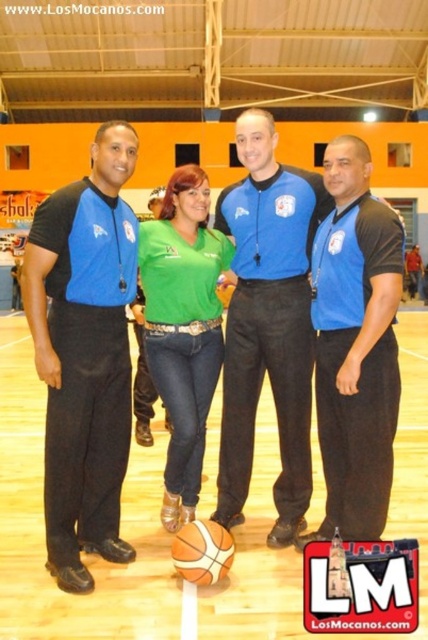
You are a photographer standing at the edge of the basketball court. You want to take a photo that includes both the blue fabric shirt at center and the orange textured basketball at center. What is the minimum distance you need to move backward to ensure both objects are in frame?

The blue fabric shirt at center and orange textured basketball at center are 36.32 inches apart from each other. To capture both in the frame, you need to move back until your camera can encompass a distance of at least 36.32 inches between them. The exact distance depends on your camera lens and sensor size, but ensuring the frame width accommodates this separation is essential.

You are standing at the origin point in the middle of the basketball court. You see the matte blue shirts at center. What are their coordinates?

The coordinates of the matte blue shirts at center are at point [83,353].

You are a photographer standing at the edge of the basketball court. You need to take a photo that includes both the matte blue shirts at center and the blue fabric shirt at center. The minimum distance between the two subjects for the photo to look balanced is 5 feet. Based on their current positions, will the photo composition be balanced?

The matte blue shirts at center is 4.18 feet from blue fabric shirt at center. Since the required minimum distance for balance is 5 feet, the photo composition will not be balanced as the current distance is shorter than required.